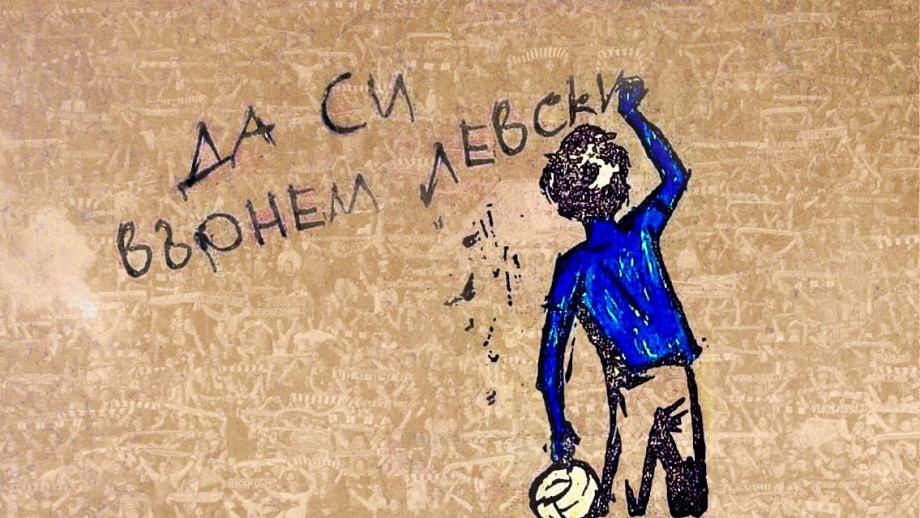
Find the location of a particular element. empty space on wall is located at coordinates (46, 238).